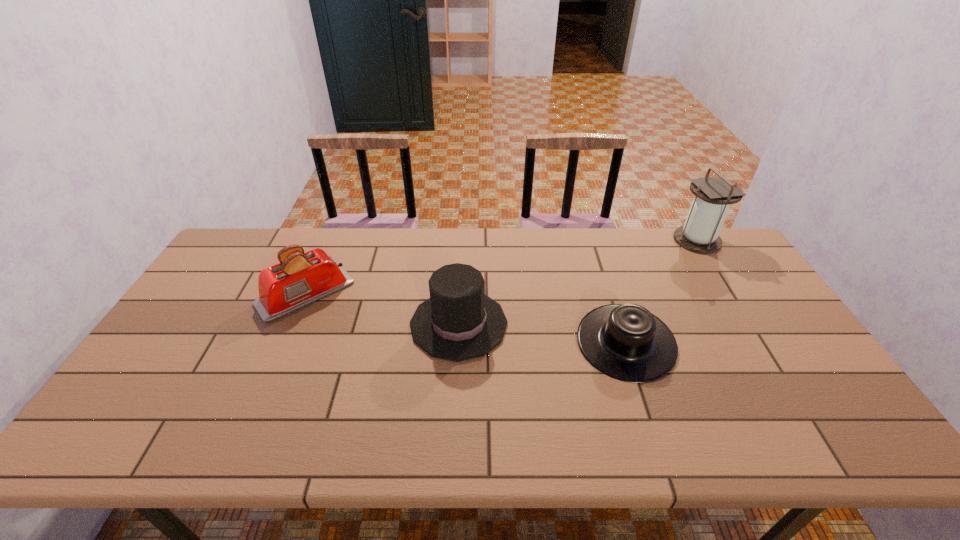
The height and width of the screenshot is (540, 960). I want to click on free space located on the left of the second object from right to left, so click(x=534, y=343).

Identify the location of lantern that is at the far edge. The image size is (960, 540). (700, 234).

Identify the location of toaster that is at the far edge. (300, 279).

Image resolution: width=960 pixels, height=540 pixels. I want to click on object present at the right edge, so click(x=700, y=234).

Where is `object at the far right corner`? This screenshot has width=960, height=540. object at the far right corner is located at coordinates [700, 234].

In order to click on vacant space at the far edge of the desktop in this screenshot , I will do click(684, 267).

At what (x,y) coordinates should I click in order to perform the action: click on vacant space at the left edge of the desktop. Please return your answer as a coordinate pair (x, y). Looking at the image, I should click on (222, 293).

Image resolution: width=960 pixels, height=540 pixels. I want to click on free space at the right edge of the desktop, so click(784, 359).

In order to click on vacant region between the rightmost object and the taller dress hat in this screenshot , I will do `click(578, 282)`.

Image resolution: width=960 pixels, height=540 pixels. I want to click on free spot between the taller dress hat and the third object from left to right, so click(542, 333).